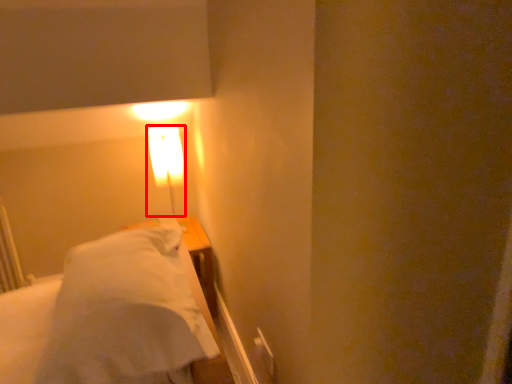
Question: Considering the relative positions of lamp (annotated by the red box) and bed in the image provided, where is lamp (annotated by the red box) located with respect to the staircase?

Choices:
 (A) right
 (B) left

Answer: (B)